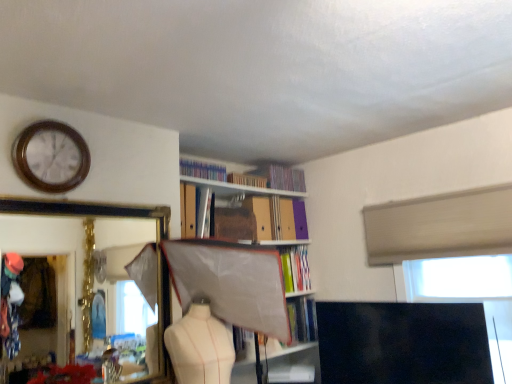
Question: Can you confirm if white plastic window screen at upper right is smaller than metallic silver book at upper center, acting as the 5th book starting from the top?

Choices:
 (A) yes
 (B) no

Answer: (B)

Question: Does white plastic window screen at upper right touch metallic silver book at upper center, which appears as the fourth book when ordered from the bottom?

Choices:
 (A) no
 (B) yes

Answer: (A)

Question: Is white plastic window screen at upper right aimed at metallic silver book at upper center, which appears as the fourth book when ordered from the bottom?

Choices:
 (A) yes
 (B) no

Answer: (B)

Question: Considering the relative positions of white plastic window screen at upper right and metallic silver book at upper center, which appears as the fourth book when ordered from the bottom, in the image provided, is white plastic window screen at upper right behind metallic silver book at upper center, which appears as the fourth book when ordered from the bottom,?

Choices:
 (A) no
 (B) yes

Answer: (A)

Question: Is white plastic window screen at upper right thinner than metallic silver book at upper center, which appears as the fourth book when ordered from the bottom?

Choices:
 (A) yes
 (B) no

Answer: (B)

Question: Is point (200, 182) closer or farther from the camera than point (196, 226)?

Choices:
 (A) farther
 (B) closer

Answer: (A)

Question: Would you say matte cardboard bookcase at center is to the left or to the right of metallic silver book at upper center, which appears as the fourth book when ordered from the bottom, in the picture?

Choices:
 (A) right
 (B) left

Answer: (A)

Question: Relative to metallic silver book at upper center, acting as the 5th book starting from the top, is matte cardboard bookcase at center in front or behind?

Choices:
 (A) behind
 (B) front

Answer: (B)

Question: From a real-world perspective, is matte cardboard bookcase at center above or below metallic silver book at upper center, acting as the 5th book starting from the top?

Choices:
 (A) below
 (B) above

Answer: (A)

Question: In the image, is hardcover book at center, which ranks as the 8th book in top-to-bottom order, on the left side or the right side of gold-framed mirror at upper left?

Choices:
 (A) right
 (B) left

Answer: (A)

Question: Considering the positions of hardcover book at center, the first book ordered from the bottom, and gold-framed mirror at upper left in the image, is hardcover book at center, the first book ordered from the bottom, taller or shorter than gold-framed mirror at upper left?

Choices:
 (A) tall
 (B) short

Answer: (B)

Question: From the image's perspective, relative to gold-framed mirror at upper left, is hardcover book at center, the first book ordered from the bottom, above or below?

Choices:
 (A) above
 (B) below

Answer: (B)

Question: From a real-world perspective, relative to gold-framed mirror at upper left, is hardcover book at center, which ranks as the 8th book in top-to-bottom order, vertically above or below?

Choices:
 (A) above
 (B) below

Answer: (B)

Question: Is hardcover books at upper center, acting as the seventh book starting from the bottom, taller or shorter than woodenclock at upper left?

Choices:
 (A) tall
 (B) short

Answer: (B)

Question: In the image, is hardcover books at upper center, acting as the seventh book starting from the bottom, on the left side or the right side of woodenclock at upper left?

Choices:
 (A) left
 (B) right

Answer: (B)